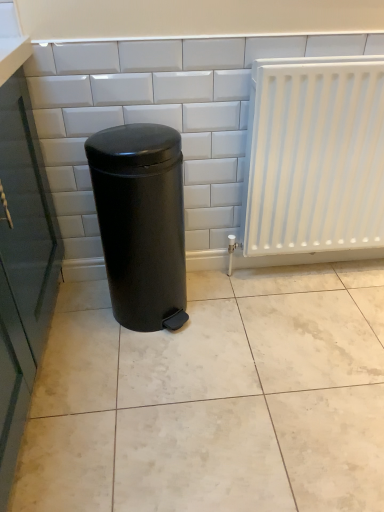
Where is `free space in front of black matte waste container at center`? Image resolution: width=384 pixels, height=512 pixels. free space in front of black matte waste container at center is located at coordinates (149, 372).